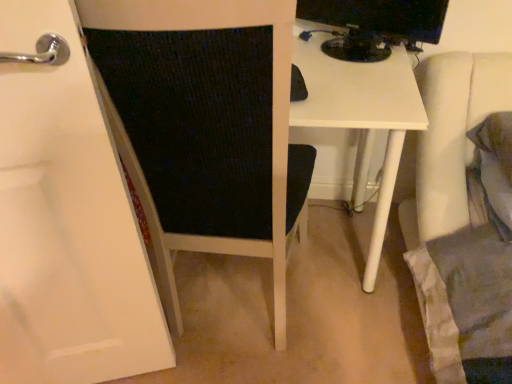
This screenshot has height=384, width=512. I want to click on vacant space underneath black glossy monitor at upper right (from a real-world perspective), so click(x=341, y=49).